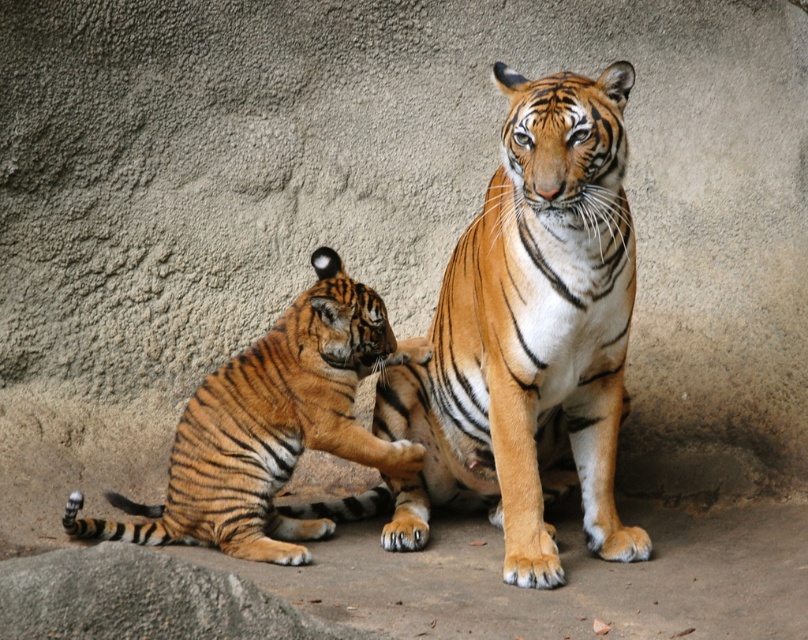
Looking at this image, you are a zookeeper observing the two tigers in the enclosure. You notice two points marked in the image. The first point is at coordinates point (459, 372) and the second is at point (365, 365). Which point is closer to you, the observer?

Point (459, 372) is in front of point (365, 365), so the first point is closer to you.